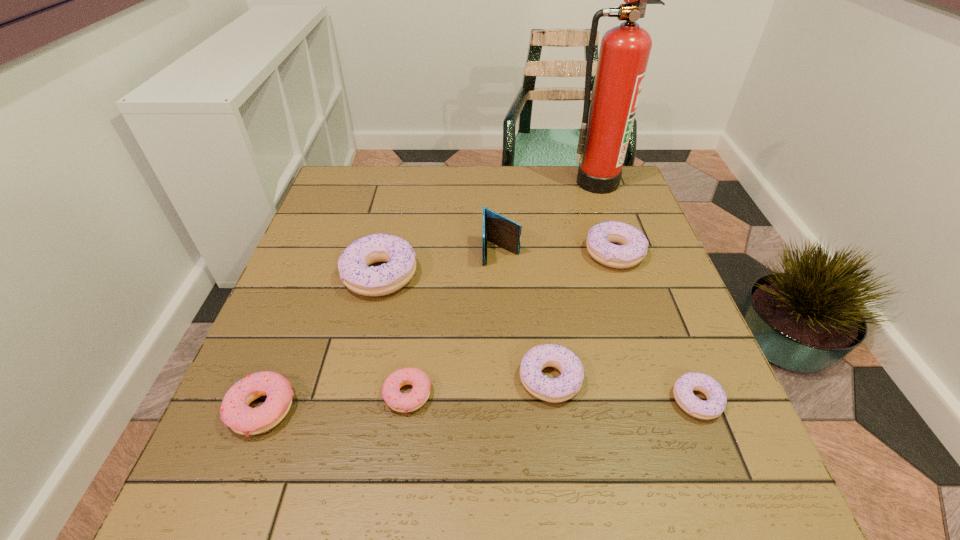
Where is `free space between the fourth doughnut from left to right and the smallest purple doughnut`? The image size is (960, 540). free space between the fourth doughnut from left to right and the smallest purple doughnut is located at coordinates (623, 390).

Identify which object is the fifth nearest to the seventh shortest object. Please provide its 2D coordinates. Your answer should be formatted as a tuple, i.e. [(x, y)], where the tuple contains the x and y coordinates of a point satisfying the conditions above.

[(402, 402)]

Select which object appears as the closest to the farthest object. Please provide its 2D coordinates. Your answer should be formatted as a tuple, i.e. [(x, y)], where the tuple contains the x and y coordinates of a point satisfying the conditions above.

[(601, 237)]

At what (x,y) coordinates should I click in order to perform the action: click on doughnut that stands as the second closest to the bigger pink doughnut. Please return your answer as a coordinate pair (x, y). The width and height of the screenshot is (960, 540). Looking at the image, I should click on (353, 265).

Locate an element on the screen. doughnut that can be found as the sixth closest to the tallest object is located at coordinates (235, 412).

Identify which purple doughnut is located as the nearest to the second tallest doughnut. Please provide its 2D coordinates. Your answer should be formatted as a tuple, i.e. [(x, y)], where the tuple contains the x and y coordinates of a point satisfying the conditions above.

[(554, 390)]

Locate which purple doughnut is the third closest to the smallest purple doughnut. Please provide its 2D coordinates. Your answer should be formatted as a tuple, i.e. [(x, y)], where the tuple contains the x and y coordinates of a point satisfying the conditions above.

[(353, 265)]

Identify the location of free location that satisfies the following two spatial constraints: 1. on the back side of the third biggest purple doughnut; 2. on the left side of the leftmost doughnut. (274, 379).

Identify the location of vacant space that satisfies the following two spatial constraints: 1. on the exterior surface of the second smallest purple doughnut; 2. on the left side of the seventh shortest object. The width and height of the screenshot is (960, 540). (507, 379).

Find the location of a particular element. This screenshot has width=960, height=540. vacant area that satisfies the following two spatial constraints: 1. on the exterior surface of the blue wallet; 2. on the left side of the fifth shortest doughnut is located at coordinates (501, 253).